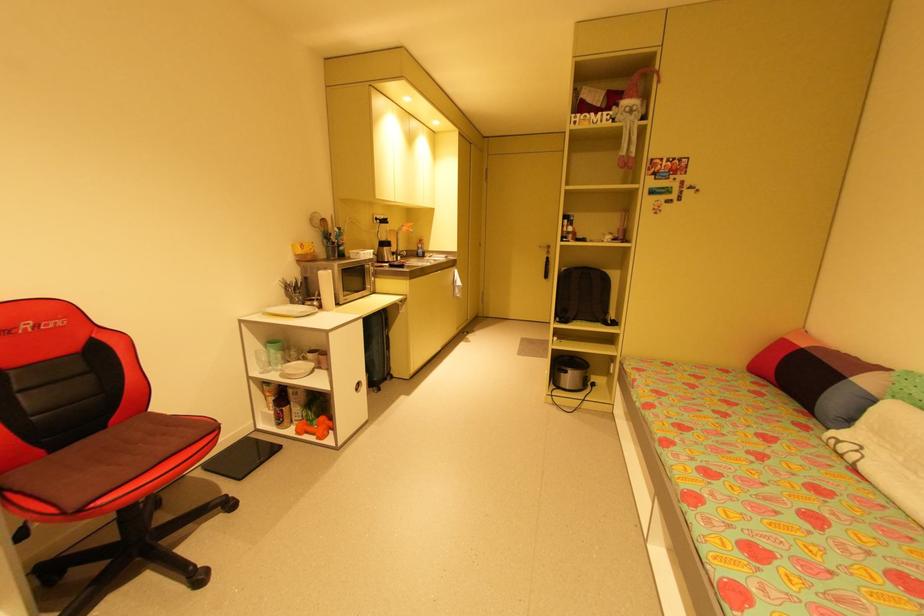
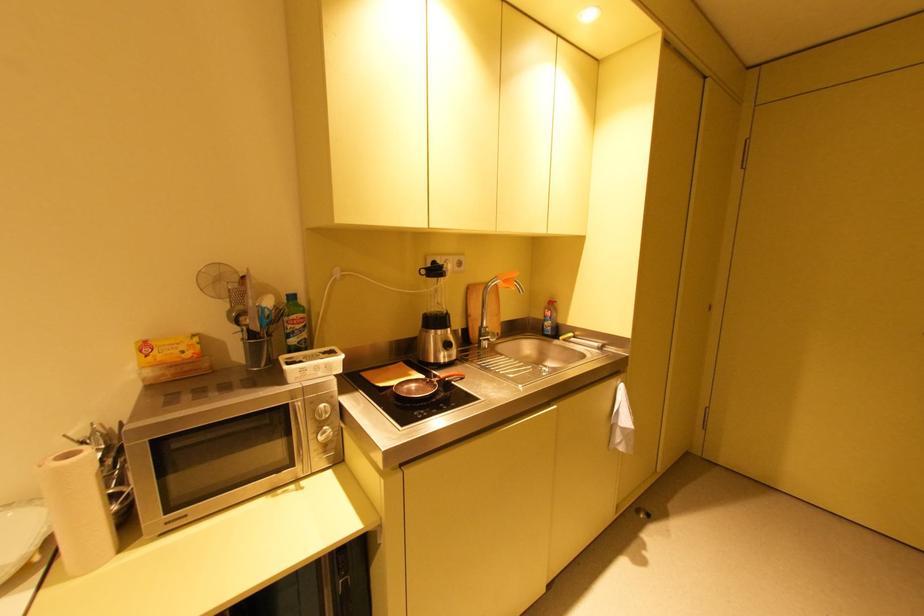
Locate, in the second image, the point that corresponds to the point at 393,248 in the first image.

(444, 331)